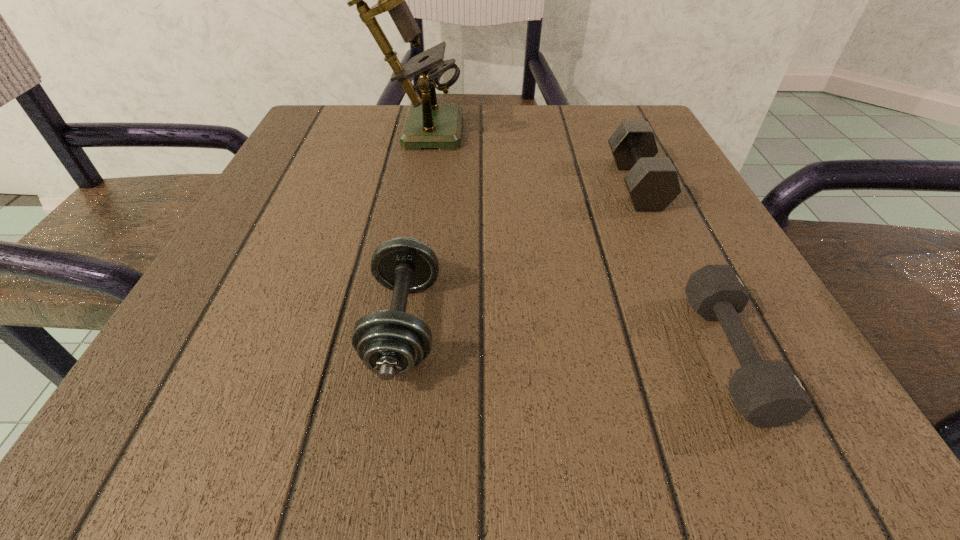
The height and width of the screenshot is (540, 960). I want to click on free space between the tallest object and the second farthest object, so click(x=525, y=155).

Point out which object is positioned as the second nearest to the farthest dumbbell. Please provide its 2D coordinates. Your answer should be formatted as a tuple, i.e. [(x, y)], where the tuple contains the x and y coordinates of a point satisfying the conditions above.

[(428, 124)]

Locate an element on the screen. The width and height of the screenshot is (960, 540). object that is the closest to the farthest dumbbell is located at coordinates (768, 393).

Where is `dumbbell object that ranks as the closest to the farthest dumbbell`? Image resolution: width=960 pixels, height=540 pixels. dumbbell object that ranks as the closest to the farthest dumbbell is located at coordinates (768, 393).

Locate an element on the screen. The image size is (960, 540). dumbbell that is the second closest one to the shortest object is located at coordinates (390, 343).

Image resolution: width=960 pixels, height=540 pixels. I want to click on free location that satisfies the following two spatial constraints: 1. at the eyepiece of the microscope; 2. on the back side of the shortest dumbbell, so click(362, 354).

Where is `free space that satisfies the following two spatial constraints: 1. at the eyepiece of the second farthest object; 2. on the right side of the microscope`? This screenshot has height=540, width=960. free space that satisfies the following two spatial constraints: 1. at the eyepiece of the second farthest object; 2. on the right side of the microscope is located at coordinates (401, 184).

In order to click on vacant region that satisfies the following two spatial constraints: 1. at the eyepiece of the third nearest object; 2. on the right side of the tallest object in this screenshot , I will do `click(401, 184)`.

The height and width of the screenshot is (540, 960). In order to click on free space that satisfies the following two spatial constraints: 1. at the eyepiece of the tallest object; 2. on the right side of the second farthest object in this screenshot , I will do `click(401, 184)`.

The height and width of the screenshot is (540, 960). I want to click on vacant space that satisfies the following two spatial constraints: 1. on the front side of the second farthest object; 2. on the right side of the shortest object, so click(713, 354).